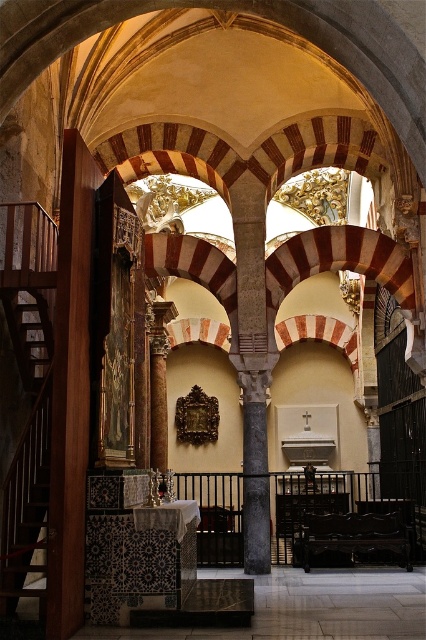
Question: Is the position of wooden staircase at left more distant than that of polished dark wood bench at center?

Choices:
 (A) yes
 (B) no

Answer: (B)

Question: Among these objects, which one is farthest from the camera?

Choices:
 (A) wooden staircase at left
 (B) polished dark wood bench at center

Answer: (B)

Question: Does wooden staircase at left appear under polished dark wood bench at center?

Choices:
 (A) yes
 (B) no

Answer: (B)

Question: Which object is closer to the camera taking this photo?

Choices:
 (A) polished dark wood bench at center
 (B) wooden staircase at left

Answer: (B)

Question: Does wooden staircase at left appear on the left side of polished dark wood bench at center?

Choices:
 (A) yes
 (B) no

Answer: (A)